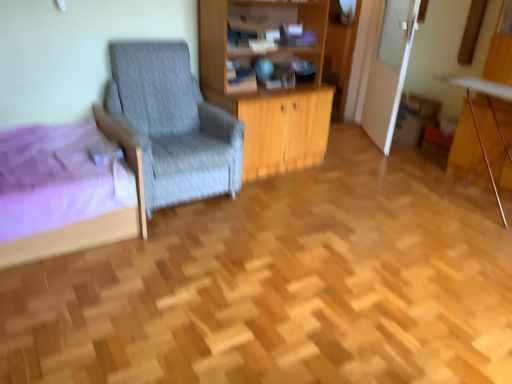
Where is `vacant region in front of wooden desk at right`? The image size is (512, 384). vacant region in front of wooden desk at right is located at coordinates (463, 230).